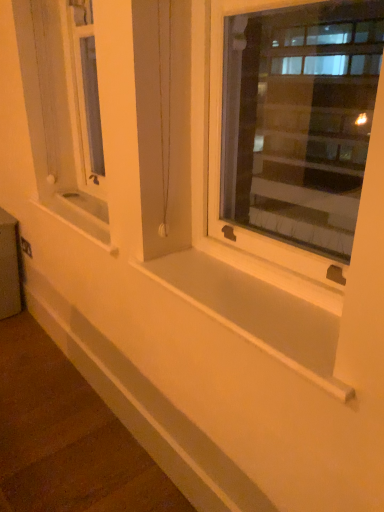
Question: From the image's perspective, does metallic silver window box at lower left appear higher than white smooth window sill at center, which is the 1th window sill in bottom-to-top order?

Choices:
 (A) no
 (B) yes

Answer: (B)

Question: Is metallic silver window box at lower left completely or partially outside of white smooth window sill at center, which is the 1th window sill in bottom-to-top order?

Choices:
 (A) no
 (B) yes

Answer: (B)

Question: From a real-world perspective, does metallic silver window box at lower left stand above white smooth window sill at center, which is the 2th window sill from top to bottom?

Choices:
 (A) no
 (B) yes

Answer: (A)

Question: Considering the relative sizes of metallic silver window box at lower left and white smooth window sill at center, which appears as the 2th window sill when viewed from the left, in the image provided, is metallic silver window box at lower left wider than white smooth window sill at center, which appears as the 2th window sill when viewed from the left,?

Choices:
 (A) yes
 (B) no

Answer: (B)

Question: Is metallic silver window box at lower left taller than white smooth window sill at center, acting as the 1th window sill starting from the front?

Choices:
 (A) yes
 (B) no

Answer: (A)

Question: Looking at the image, does white smooth window sill at center, the second window sill positioned from the bottom, seem bigger or smaller compared to metallic silver window box at lower left?

Choices:
 (A) small
 (B) big

Answer: (A)

Question: Is white smooth window sill at center, marked as the second window sill in a front-to-back arrangement, situated inside metallic silver window box at lower left or outside?

Choices:
 (A) inside
 (B) outside

Answer: (B)

Question: Considering their positions, is white smooth window sill at center, the second window sill positioned from the bottom, located in front of or behind metallic silver window box at lower left?

Choices:
 (A) front
 (B) behind

Answer: (A)

Question: From the image's perspective, is white smooth window sill at center, which is counted as the second window sill, starting from the right, located above or below metallic silver window box at lower left?

Choices:
 (A) below
 (B) above

Answer: (B)

Question: Is point (61, 195) closer or farther from the camera than point (168, 404)?

Choices:
 (A) closer
 (B) farther

Answer: (B)

Question: From a real-world perspective, is white smooth window sill at center, which is counted as the first window sill, starting from the back, positioned above or below white smooth ledge at lower center?

Choices:
 (A) below
 (B) above

Answer: (B)

Question: Considering the relative positions of white smooth window sill at center, the first window sill from the top, and white smooth ledge at lower center in the image provided, is white smooth window sill at center, the first window sill from the top, to the left or to the right of white smooth ledge at lower center?

Choices:
 (A) left
 (B) right

Answer: (B)

Question: In terms of width, does white smooth window sill at center, which is counted as the first window sill, starting from the back, look wider or thinner when compared to white smooth ledge at lower center?

Choices:
 (A) wide
 (B) thin

Answer: (A)

Question: Is point (16, 242) closer or farther from the camera than point (344, 87)?

Choices:
 (A) farther
 (B) closer

Answer: (B)

Question: In terms of size, does metallic silver window box at lower left appear bigger or smaller than white plastic window at center?

Choices:
 (A) small
 (B) big

Answer: (B)